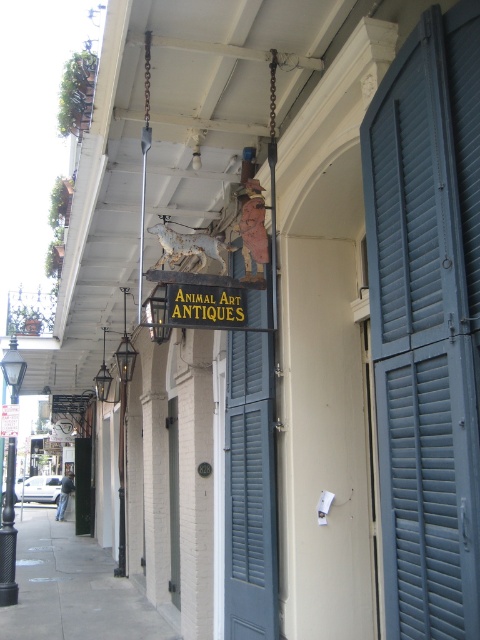
Between blue painted wood shutters at right and gold metallic sign at center, which one appears on the right side from the viewer's perspective?

blue painted wood shutters at right

Is blue painted wood shutters at right shorter than gold metallic sign at center?

Incorrect, blue painted wood shutters at right's height does not fall short of gold metallic sign at center's.

Does point (462, 456) come closer to viewer compared to point (7, 412)?

Yes, point (462, 456) is in front of point (7, 412).

Image resolution: width=480 pixels, height=640 pixels. Identify the location of blue painted wood shutters at right. (427, 323).

Is point (420, 323) in front of point (95, 589)?

That is True.

Does blue painted wood shutters at right have a lesser width compared to gray concrete sidewalk at lower left?

Yes.

Identify the location of blue painted wood shutters at right. The image size is (480, 640). (427, 323).

Who is positioned more to the left, gray concrete sidewalk at lower left or gold metallic sign at center?

Positioned to the left is gray concrete sidewalk at lower left.

Is point (21, 632) positioned before point (15, 433)?

Yes, it is in front of point (15, 433).

What do you see at coordinates (72, 588) in the screenshot? This screenshot has width=480, height=640. I see `gray concrete sidewalk at lower left` at bounding box center [72, 588].

Find the location of `gray concrete sidewalk at lower left`. gray concrete sidewalk at lower left is located at coordinates (72, 588).